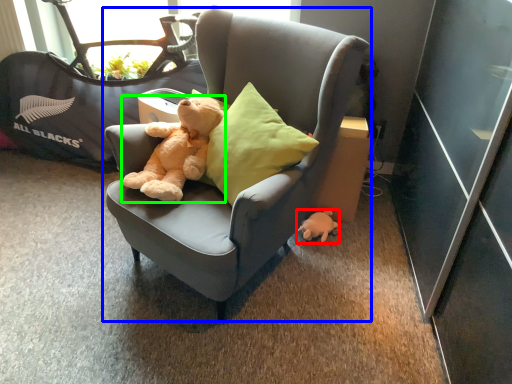
Question: Which is nearer to the toy (highlighted by a red box)? chair (highlighted by a blue box) or teddy bear (highlighted by a green box).

Choices:
 (A) chair
 (B) teddy bear

Answer: (A)